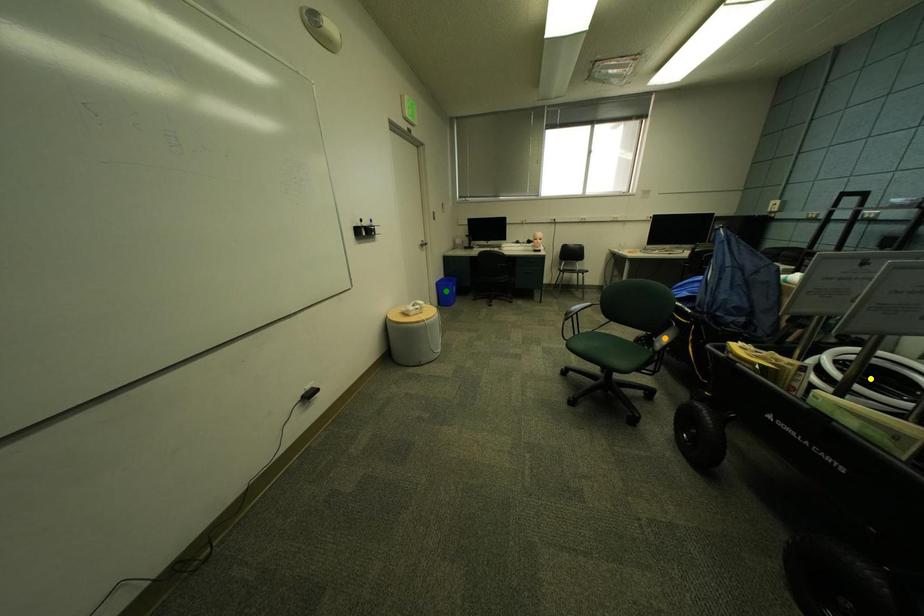
Order these from nearest to farthest:
orange point | green point | yellow point

yellow point, orange point, green point